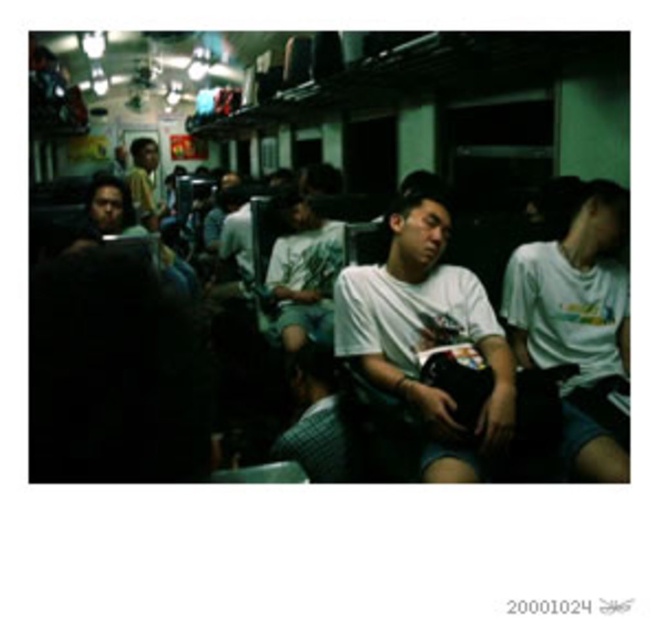
How much distance is there between white cotton shirt at right and white matte shirt at center?

white cotton shirt at right is 1.38 meters from white matte shirt at center.

Measure the distance between point (598, 269) and camera.

Point (598, 269) and camera are 9.51 feet apart from each other.

Which is in front, point (616, 257) or point (275, 294)?

Positioned in front is point (616, 257).

At what (x,y) coordinates should I click in order to perform the action: click on white cotton shirt at right. Please return your answer as a coordinate pair (x, y). Image resolution: width=659 pixels, height=640 pixels. Looking at the image, I should click on (577, 305).

Can you confirm if white cotton shirt at right is positioned below yellow shirt at upper left?

Yes.

Is white cotton shirt at right thinner than yellow shirt at upper left?

In fact, white cotton shirt at right might be wider than yellow shirt at upper left.

Is point (548, 262) less distant than point (146, 189)?

Yes, it is.

Find the location of `white cotton shirt at right`. white cotton shirt at right is located at coordinates coord(577,305).

Locate an element on the screen. white cotton shirt at center is located at coordinates (426, 337).

Measure the distance between white cotton shirt at center and camera.

white cotton shirt at center and camera are 6.77 feet apart from each other.

Is point (382, 364) positioned before point (140, 212)?

Yes, it is in front of point (140, 212).

At what (x,y) coordinates should I click in order to perform the action: click on white cotton shirt at center. Please return your answer as a coordinate pair (x, y). Looking at the image, I should click on (426, 337).